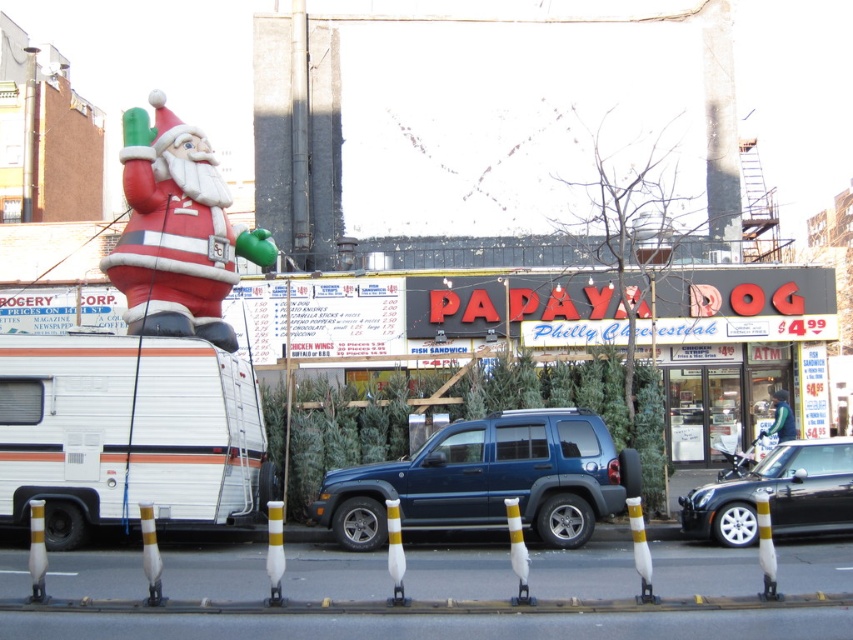
Does white matte camper van at left appear over matte plastic santa at upper left?

Incorrect, white matte camper van at left is not positioned above matte plastic santa at upper left.

Identify the location of white matte camper van at left. The width and height of the screenshot is (853, 640). (126, 433).

Does metallic blue suv at center appear under shiny black car at center?

Yes, metallic blue suv at center is below shiny black car at center.

Does metallic blue suv at center have a greater height compared to shiny black car at center?

Correct, metallic blue suv at center is much taller as shiny black car at center.

Which is in front, point (346, 515) or point (845, 493)?

Point (845, 493)

Identify the location of metallic blue suv at center. This screenshot has width=853, height=640. (488, 480).

Image resolution: width=853 pixels, height=640 pixels. In order to click on white matte camper van at left in this screenshot , I will do `click(126, 433)`.

The width and height of the screenshot is (853, 640). What are the coordinates of `white matte camper van at left` in the screenshot? It's located at (126, 433).